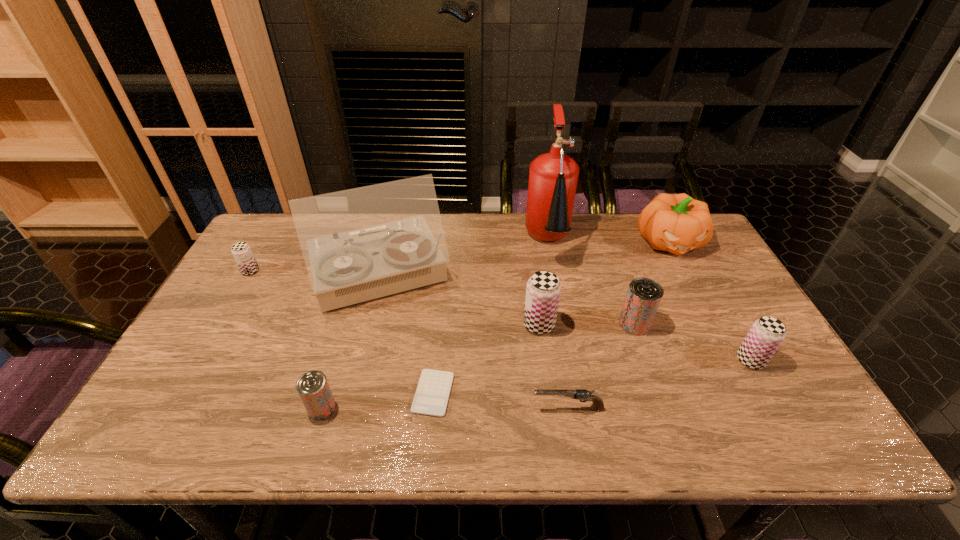
Identify the location of fire extinguisher located in the far edge section of the desktop. The width and height of the screenshot is (960, 540). (553, 176).

The image size is (960, 540). I want to click on record player that is positioned at the far edge, so click(364, 243).

This screenshot has height=540, width=960. I want to click on pumpkin that is at the far edge, so click(677, 223).

Locate an element on the screen. This screenshot has height=540, width=960. beer can at the near edge is located at coordinates (314, 391).

I want to click on gun located in the near edge section of the desktop, so click(579, 394).

This screenshot has width=960, height=540. What are the coordinates of `calculator at the near edge` in the screenshot? It's located at click(x=431, y=398).

Locate an element on the screen. The height and width of the screenshot is (540, 960). object that is positioned at the left edge is located at coordinates (241, 251).

This screenshot has width=960, height=540. What are the coordinates of `pumpkin that is at the right edge` in the screenshot? It's located at (677, 223).

This screenshot has height=540, width=960. What are the coordinates of `beer can located at the right edge` in the screenshot? It's located at (765, 336).

Where is `object at the far right corner`? The width and height of the screenshot is (960, 540). object at the far right corner is located at coordinates (677, 223).